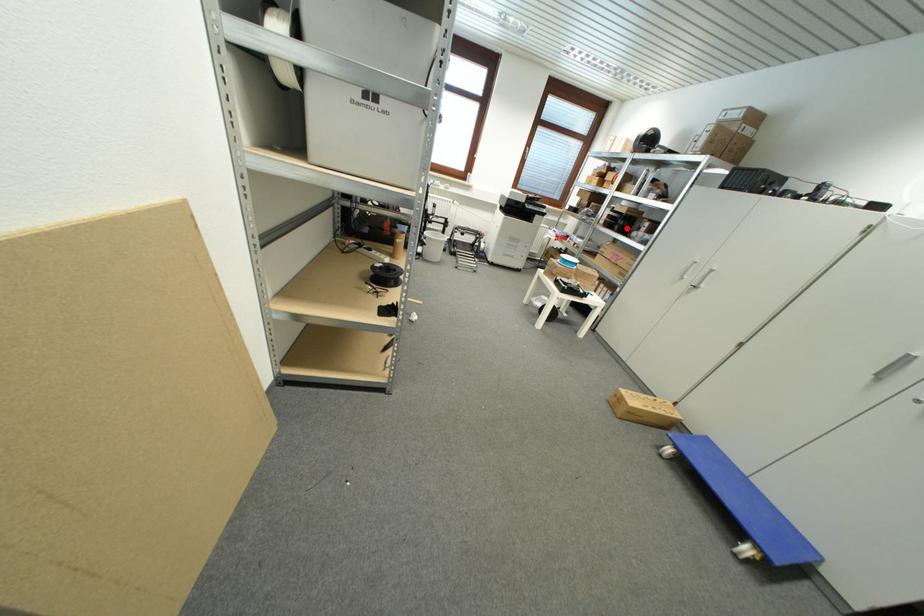
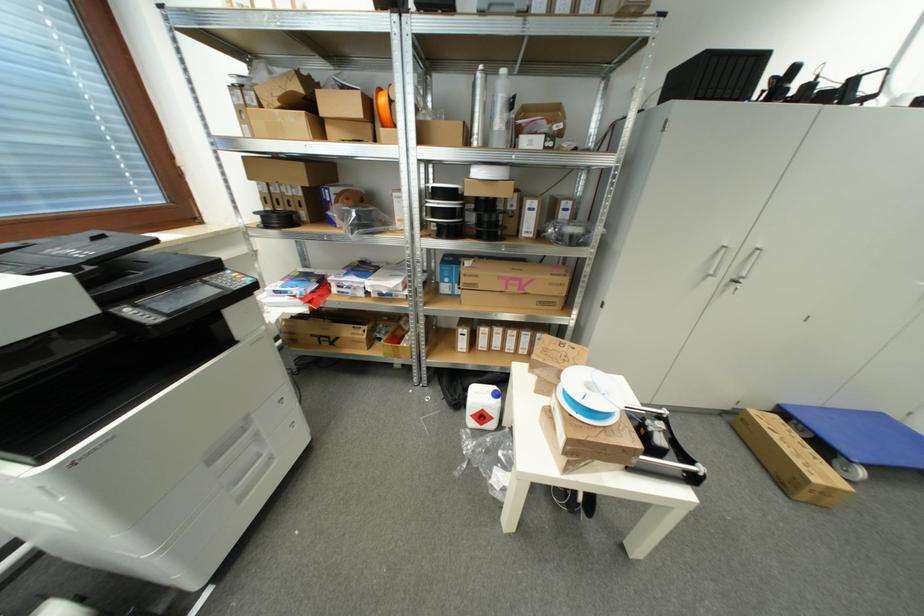
Question: A red point is marked in image1. In image2, is the corresponding 3D point closer to the camera or farther? Reply with the corresponding letter.

Choices:
 (A) The corresponding 3D point is closer.
 (B) The corresponding 3D point is farther.

Answer: (B)